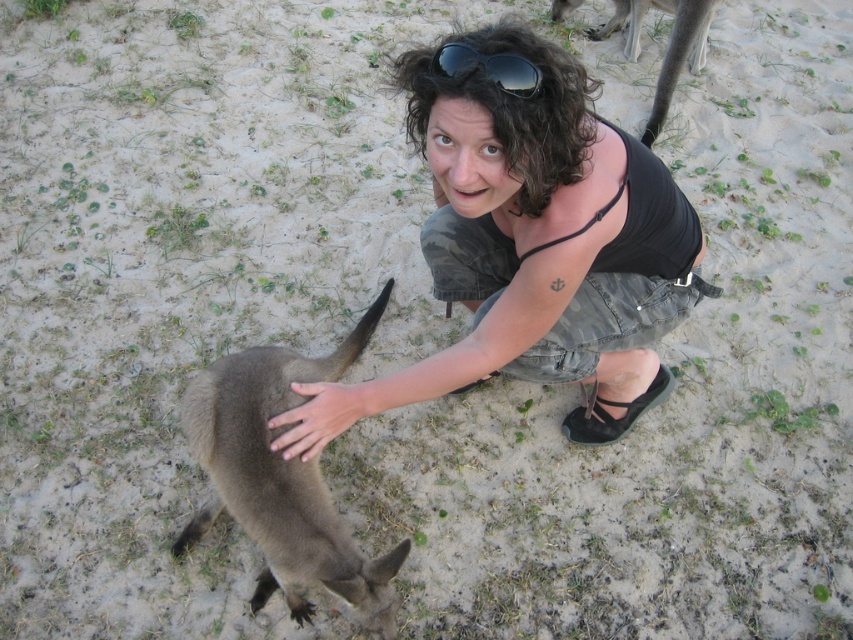
You are a photographer trying to capture the woman and the kangaroo in a photo. The matte black tank top at center is at point 0.389, 0.626. If you want to ensure the tank top is in the center of the photo, where should you position your camera?

To center the matte black tank top at center, position your camera so that the tank top is at the coordinates (532, 248), which is already its current position.

You are a photographer trying to capture the woman and the kangaroo. You notice the brown fur at lower right and the black reflective sunglasses at upper center. Which object would you need to adjust your camera focus more for if you want to capture both clearly in the same frame?

The brown fur at lower right is larger in width than the black reflective sunglasses at upper center, so you would need to adjust your camera focus more for the brown fur at lower right to ensure both are clear.

You are a photographer trying to capture the woman and the kangaroo. You notice the brown fur at lower right and the black reflective sunglasses at upper center in your frame. Which object is closer to your camera lens?

The brown fur at lower right is closer to the camera lens because it is further to the viewer than the black reflective sunglasses at upper center.